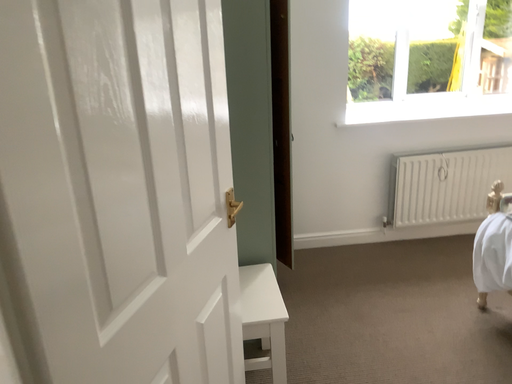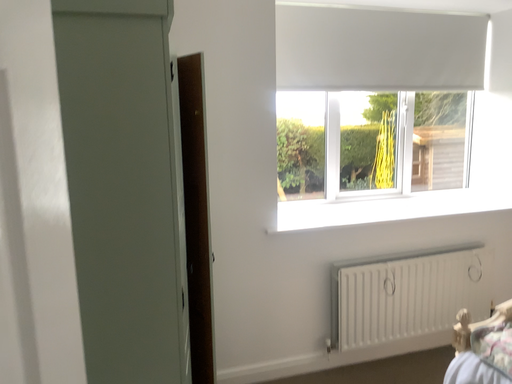
Question: Which way did the camera rotate in the video?

Choices:
 (A) rotated upward
 (B) rotated downward

Answer: (A)